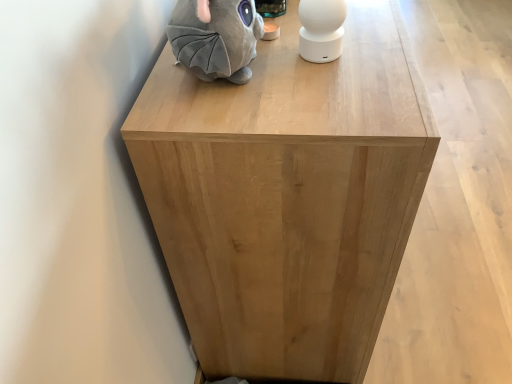
The image size is (512, 384). Find the location of `free region under gray plush toy at upper left, marked as the 2th toy in a right-to-left arrangement (from a real-world perspective)`. free region under gray plush toy at upper left, marked as the 2th toy in a right-to-left arrangement (from a real-world perspective) is located at coordinates (223, 84).